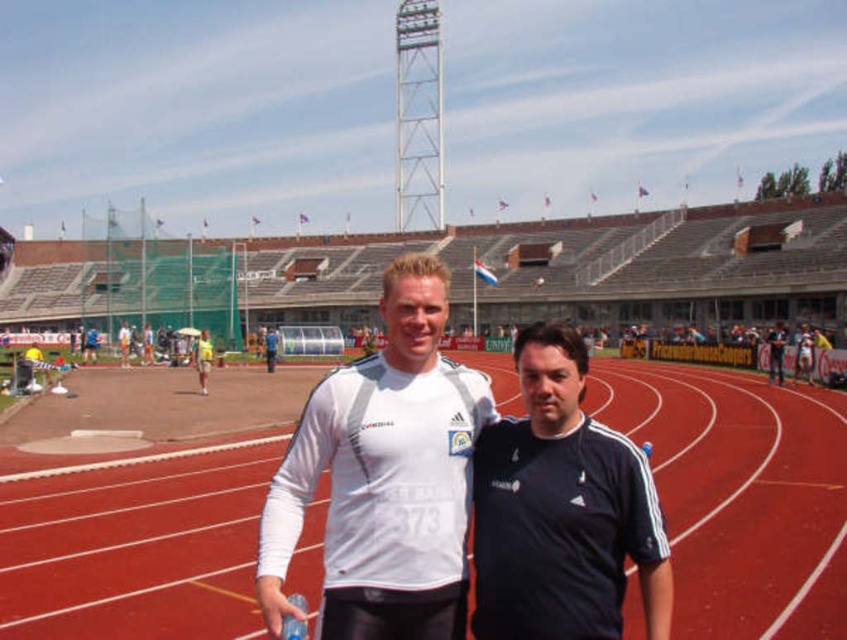
You are a photographer at a stadium event. You need to capture a photo where the black matte shirt at center is clearly visible without the red rubber track at center showing underneath it. Is this possible based on their positions?

The red rubber track at center is positioned under the black matte shirt at center, so it is possible to capture the photo by focusing on the upper part of the black matte shirt at center to avoid the track underneath.

You are a photographer at a sports event. You need to capture a photo of the white matte jersey at center and the yellow fabric shorts at center. Based on their positions, which one should you focus on first to ensure they are both in the frame?

The white matte jersey at center is below the yellow fabric shorts at center, so you should focus on the yellow fabric shorts at center first to ensure both are in the frame.

You are a photographer at a sports event. You need to capture a photo of the white matte jersey at center and the black matte shirt at center. Which one should you focus on if you want to ensure that the larger object is in sharp focus?

The white matte jersey at center is bigger than the black matte shirt at center, so you should focus on the white matte jersey at center to ensure the larger object is in sharp focus.